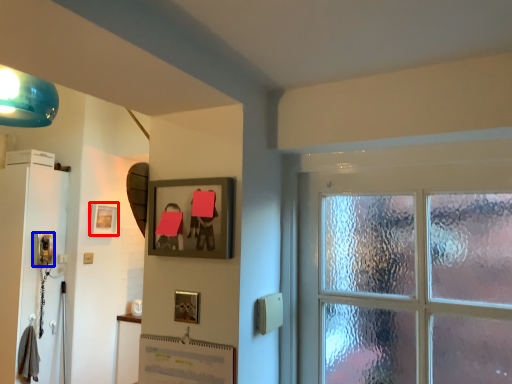
Question: Which of the following is the farthest to the observer, picture frame (highlighted by a red box) or corded phone (highlighted by a blue box)?

Choices:
 (A) picture frame
 (B) corded phone

Answer: (A)